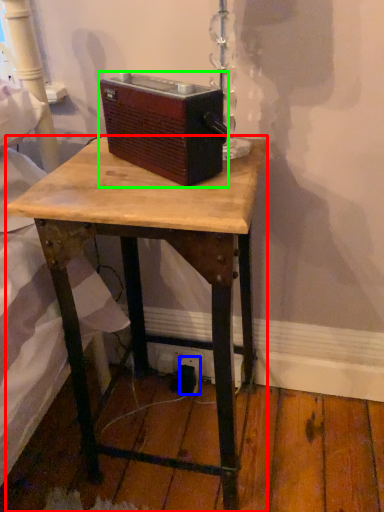
Question: Estimate the real-world distances between objects in this image. Which object is farther from desk (highlighted by a red box), electric outlet (highlighted by a blue box) or gadget (highlighted by a green box)?

Choices:
 (A) electric outlet
 (B) gadget

Answer: (A)